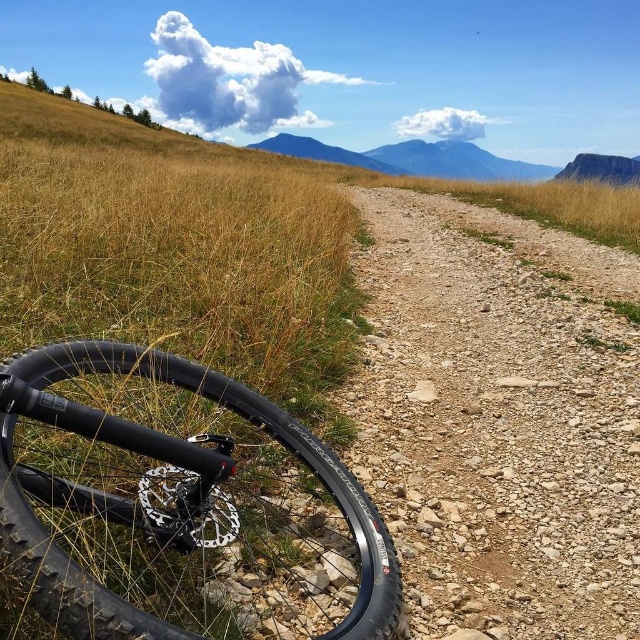
Is point (573, 364) in front of point (19, 554)?

No, (573, 364) is further to viewer.

Who is lower down, dusty gravel path at center or black rubber tire at lower left?

black rubber tire at lower left

Between point (445, 342) and point (372, 598), which one is positioned behind?

Point (445, 342)

This screenshot has width=640, height=640. In order to click on dusty gravel path at center in this screenshot , I will do `click(499, 419)`.